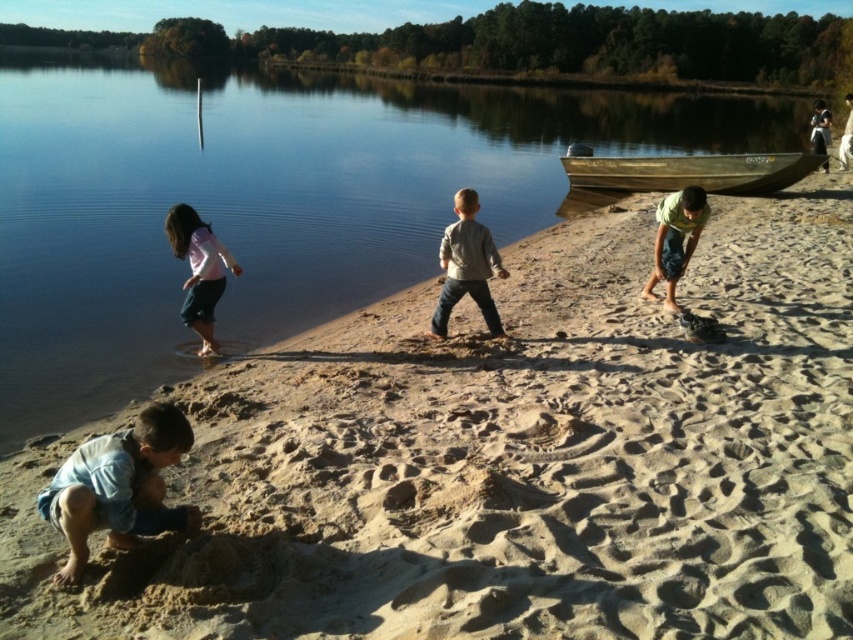
Question: Which of the following is the closest to the observer?

Choices:
 (A) brown sandy beach at lower center
 (B) light gray denim jeans at center
 (C) matte pink shirt at left

Answer: (A)

Question: Which point is farther to the camera?

Choices:
 (A) (61, 288)
 (B) (747, 180)
 (C) (483, 244)

Answer: (B)

Question: Can you confirm if wooden boat at upper right is smaller than green textured shirt at right?

Choices:
 (A) no
 (B) yes

Answer: (A)

Question: Which point is farther to the camera?

Choices:
 (A) (567, 170)
 (B) (115, 540)
 (C) (811, 129)
 (D) (703, 225)

Answer: (C)

Question: Does wooden boat at upper right lie behind matte pink shirt at left?

Choices:
 (A) no
 (B) yes

Answer: (B)

Question: Can you confirm if light gray denim jeans at center is thinner than light brown wooden pole at upper center?

Choices:
 (A) yes
 (B) no

Answer: (A)